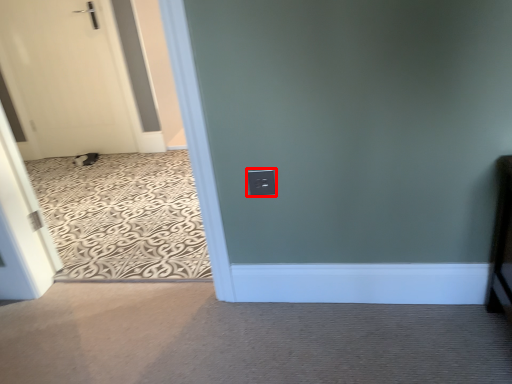
Question: In this image, where is electric outlet (annotated by the red box) located relative to door?

Choices:
 (A) left
 (B) right

Answer: (B)